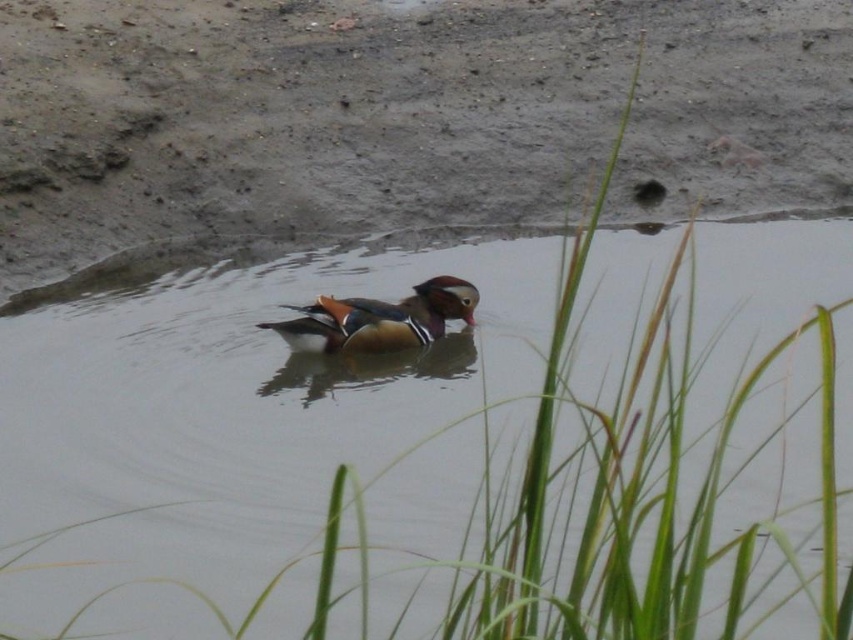
You are a photographer trying to capture the shiny brown wood duck at center and the brown matte mud at center in a single shot. Which object should you focus on first to ensure both are in focus?

You should focus on the brown matte mud at center first because the shiny brown wood duck at center is behind it, so adjusting focus starting from the closer object will help capture both in focus.

You are standing on the bank of the pond and see the shiny brown wood duck at center and the brown matte mud at center. Which object is located to the right of the other?

The brown matte mud at center is located to the right of the shiny brown wood duck at center.

You are a photographer trying to capture the shiny brown wood duck at center in the image. The brown matte mud at center is in the way. Can you estimate if the mud is wider than the duck?

The brown matte mud at center might be wider than shiny brown wood duck at center, so there is a possibility that the mud is wider and might block the view of the duck. Adjust your position to ensure the duck is fully visible.